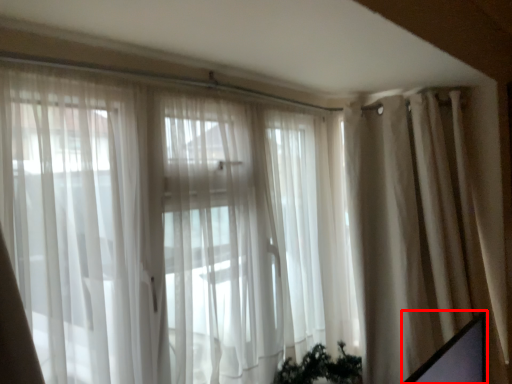
Question: Considering the relative positions of computer screen (annotated by the red box) and curtain in the image provided, where is computer screen (annotated by the red box) located with respect to the staircase?

Choices:
 (A) left
 (B) right

Answer: (A)